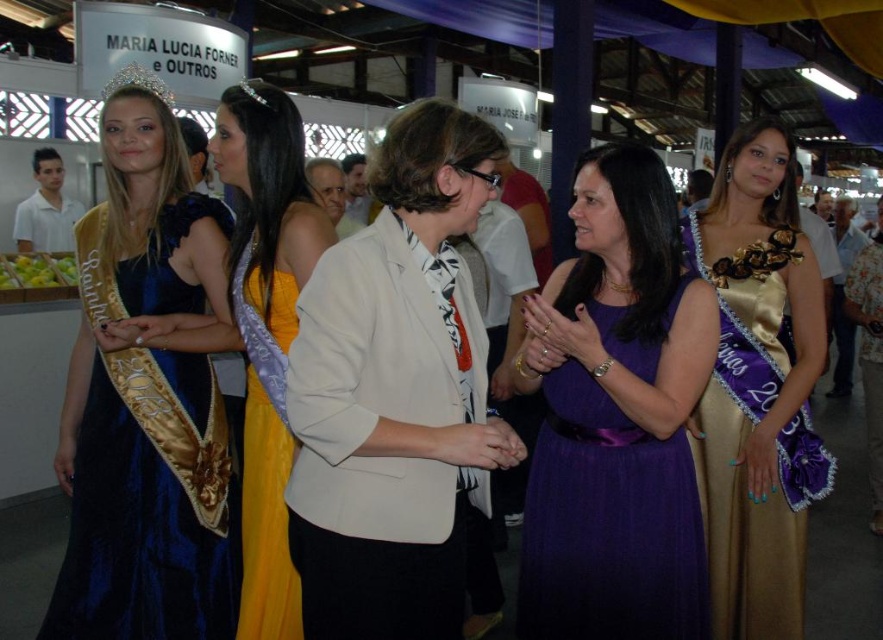
Question: Based on their relative distances, which object is nearer to the blue satin dress at upper left?

Choices:
 (A) gold shiny crown at upper left
 (B) gold shiny tiara at upper left

Answer: (B)

Question: Can you confirm if purple satin dress at center is wider than gold shiny crown at upper left?

Choices:
 (A) yes
 (B) no

Answer: (A)

Question: Does blue satin dress at upper left have a greater width compared to yellow satin dress at center?

Choices:
 (A) no
 (B) yes

Answer: (B)

Question: Estimate the real-world distances between objects in this image. Which object is closer to the gold shiny tiara at upper left?

Choices:
 (A) gold satin dress at right
 (B) gold shiny crown at upper left
 (C) blue satin dress at upper left
 (D) purple satin dress at center

Answer: (B)

Question: Is blue satin dress at upper left positioned before yellow satin dress at center?

Choices:
 (A) yes
 (B) no

Answer: (A)

Question: Which object is closer to the camera taking this photo?

Choices:
 (A) purple satin dress at center
 (B) velvet blue dress at left
 (C) yellow satin dress at center
 (D) gold shiny tiara at upper left

Answer: (A)